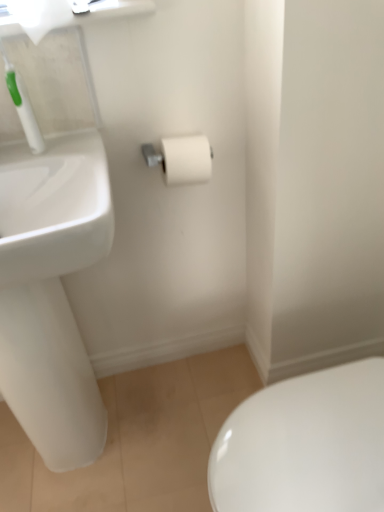
Question: Would you say white matte toilet paper at upper left, which appears as the first toilet paper when viewed from the left, is to the left or to the right of white plastic toothbrush at upper left in the picture?

Choices:
 (A) left
 (B) right

Answer: (B)

Question: Do you think white matte toilet paper at upper left, the 1th toilet paper in the top-to-bottom sequence, is within white plastic toothbrush at upper left, or outside of it?

Choices:
 (A) inside
 (B) outside

Answer: (B)

Question: Which object is positioned closest to the white matte toilet paper at center, arranged as the second toilet paper when viewed from the top?

Choices:
 (A) white glossy sink at left
 (B) white matte toilet paper at upper left, which appears as the first toilet paper when viewed from the left
 (C) white plastic toothbrush at upper left

Answer: (C)

Question: Which object is the farthest from the white plastic toothbrush at upper left?

Choices:
 (A) white matte toilet paper at upper left, the 1th toilet paper in the top-to-bottom sequence
 (B) white matte toilet paper at center, which is the first toilet paper in bottom-to-top order
 (C) white glossy sink at left

Answer: (C)